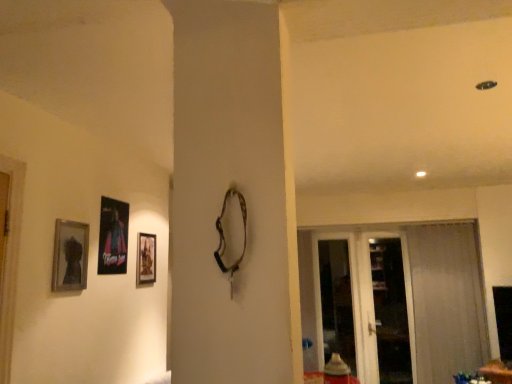
What do you see at coordinates (113, 237) in the screenshot?
I see `metallic poster at left, which appears as the 2th picture frame when viewed from the front` at bounding box center [113, 237].

You are a GUI agent. You are given a task and a screenshot of the screen. Output one action in this format:
    pyautogui.click(x=<x>, y=<y>)
    Task: Click on the metallic poster at left, which appears as the 2th picture frame when viewed from the front
    Image resolution: width=512 pixels, height=384 pixels.
    Given the screenshot: What is the action you would take?
    pyautogui.click(x=113, y=237)

Locate an element on the screen. matte black picture frame at left, acting as the first picture frame starting from the left is located at coordinates (70, 256).

The height and width of the screenshot is (384, 512). What do you see at coordinates (70, 256) in the screenshot?
I see `matte black picture frame at left, which is the 3th picture frame from back to front` at bounding box center [70, 256].

At what (x,y) coordinates should I click in order to perform the action: click on metallic poster at left, placed as the 2th picture frame when sorted from back to front. Please return your answer as a coordinate pair (x, y). Image resolution: width=512 pixels, height=384 pixels. Looking at the image, I should click on (113, 237).

Which object is thinner, transparent glass screen door at right, marked as the first screen door in a left-to-right arrangement, or metallic poster at left, placed as the 2th picture frame when sorted from back to front?

Thinner between the two is metallic poster at left, placed as the 2th picture frame when sorted from back to front.

The width and height of the screenshot is (512, 384). In order to click on the 2nd picture frame counting from the left of the transparent glass screen door at right, acting as the second screen door starting from the right in this screenshot , I will do `click(113, 237)`.

Is transparent glass screen door at right, acting as the second screen door starting from the right, looking in the opposite direction of metallic poster at left, placed as the 2th picture frame when sorted from back to front?

transparent glass screen door at right, acting as the second screen door starting from the right, is not turned away from metallic poster at left, placed as the 2th picture frame when sorted from back to front.

Is sheer white curtain at right bigger than transparent glass screen door at right, which ranks as the 1th screen door in right-to-left order?

Yes.

Can you confirm if sheer white curtain at right is wider than transparent glass screen door at right, which ranks as the 1th screen door in right-to-left order?

Yes.

Which point is more distant from viewer, (420, 348) or (343, 244)?

The point (343, 244) is farther from the camera.

Is transparent glass screen door at right, the 2th screen door viewed from the left, inside sheer white curtain at right?

No, sheer white curtain at right does not contain transparent glass screen door at right, the 2th screen door viewed from the left.

Would you say transparent glass screen door at right, marked as the first screen door in a left-to-right arrangement, is part of metallic poster at left, placed as the 2th picture frame when sorted from right to left,'s contents?

No, transparent glass screen door at right, marked as the first screen door in a left-to-right arrangement, is located outside of metallic poster at left, placed as the 2th picture frame when sorted from right to left.

Is metallic poster at left, which appears as the 2th picture frame when viewed from the front, next to transparent glass screen door at right, marked as the first screen door in a left-to-right arrangement, and touching it?

metallic poster at left, which appears as the 2th picture frame when viewed from the front, is not next to transparent glass screen door at right, marked as the first screen door in a left-to-right arrangement, and they're not touching.

From the image's perspective, between metallic poster at left, the second picture frame viewed from the left, and transparent glass screen door at right, marked as the first screen door in a left-to-right arrangement, who is located below?

From the image's view, transparent glass screen door at right, marked as the first screen door in a left-to-right arrangement, is below.

Is transparent glass screen door at right, acting as the second screen door starting from the right, at the back of matte wooden picture frame at center, which is the 3th picture frame from front to back?

matte wooden picture frame at center, which is the 3th picture frame from front to back, does not have its back to transparent glass screen door at right, acting as the second screen door starting from the right.

Looking at this image, which object is positioned more to the left, matte wooden picture frame at center, which is the 3th picture frame from front to back, or transparent glass screen door at right, marked as the first screen door in a left-to-right arrangement?

Positioned to the left is matte wooden picture frame at center, which is the 3th picture frame from front to back.

Could you measure the distance between matte wooden picture frame at center, placed as the third picture frame when sorted from left to right, and transparent glass screen door at right, marked as the first screen door in a left-to-right arrangement?

matte wooden picture frame at center, placed as the third picture frame when sorted from left to right, is 7.64 feet away from transparent glass screen door at right, marked as the first screen door in a left-to-right arrangement.

In the image, is matte wooden picture frame at center, which is the 3th picture frame from front to back, positioned in front of or behind transparent glass screen door at right, marked as the first screen door in a left-to-right arrangement?

In the image, matte wooden picture frame at center, which is the 3th picture frame from front to back, appears in front of transparent glass screen door at right, marked as the first screen door in a left-to-right arrangement.

Which is in front, point (442, 250) or point (121, 264)?

The point (121, 264) is closer.

How many degrees apart are the facing directions of sheer white curtain at right and metallic poster at left, which appears as the 2th picture frame when viewed from the front?

There is a 90-degree angle between the facing directions of sheer white curtain at right and metallic poster at left, which appears as the 2th picture frame when viewed from the front.

Considering the sizes of objects sheer white curtain at right and metallic poster at left, which appears as the 2th picture frame when viewed from the front, in the image provided, who is wider, sheer white curtain at right or metallic poster at left, which appears as the 2th picture frame when viewed from the front,?

Wider between the two is sheer white curtain at right.

Is matte black picture frame at left, which ranks as the 3th picture frame in right-to-left order, located outside metallic poster at left, the second picture frame viewed from the left?

That's correct, matte black picture frame at left, which ranks as the 3th picture frame in right-to-left order, is outside of metallic poster at left, the second picture frame viewed from the left.

Which object is further away from the camera taking this photo, matte black picture frame at left, acting as the first picture frame starting from the left, or metallic poster at left, which appears as the 2th picture frame when viewed from the front?

Positioned behind is metallic poster at left, which appears as the 2th picture frame when viewed from the front.

Considering the sizes of objects matte black picture frame at left, which is the 3th picture frame from back to front, and metallic poster at left, the second picture frame viewed from the left, in the image provided, who is shorter, matte black picture frame at left, which is the 3th picture frame from back to front, or metallic poster at left, the second picture frame viewed from the left,?

matte black picture frame at left, which is the 3th picture frame from back to front.

Relative to transparent glass screen door at right, acting as the second screen door starting from the right, is matte black picture frame at left, which ranks as the 3th picture frame in right-to-left order, in front or behind?

matte black picture frame at left, which ranks as the 3th picture frame in right-to-left order, is positioned closer to the viewer than transparent glass screen door at right, acting as the second screen door starting from the right.

Which is in front, point (86, 231) or point (331, 306)?

Point (86, 231)

From the image's perspective, is matte black picture frame at left, acting as the first picture frame starting from the left, positioned above or below transparent glass screen door at right, acting as the second screen door starting from the right?

From the image's perspective, matte black picture frame at left, acting as the first picture frame starting from the left, appears above transparent glass screen door at right, acting as the second screen door starting from the right.

Locate an element on the screen. The image size is (512, 384). screen door that is the 1st one when counting downward from the matte black picture frame at left, which ranks as the 3th picture frame in right-to-left order (from the image's perspective) is located at coordinates (335, 298).

Locate an element on the screen. This screenshot has height=384, width=512. the 2nd picture frame in front when counting from the transparent glass screen door at right, marked as the first screen door in a left-to-right arrangement is located at coordinates (113, 237).

The width and height of the screenshot is (512, 384). Find the location of `curtain that appears on the right of transparent glass screen door at right, which ranks as the 1th screen door in right-to-left order`. curtain that appears on the right of transparent glass screen door at right, which ranks as the 1th screen door in right-to-left order is located at coordinates (447, 301).

Based on their spatial positions, is matte wooden picture frame at center, which is the 3th picture frame from front to back, or metallic poster at left, placed as the 2th picture frame when sorted from back to front, closer to transparent glass screen door at right, the 2th screen door viewed from the left?

Based on the image, matte wooden picture frame at center, which is the 3th picture frame from front to back, appears to be nearer to transparent glass screen door at right, the 2th screen door viewed from the left.

Which object lies nearer to the anchor point matte wooden picture frame at center, which is the 3th picture frame from front to back, sheer white curtain at right or transparent glass screen door at right, marked as the first screen door in a left-to-right arrangement?

Among the two, transparent glass screen door at right, marked as the first screen door in a left-to-right arrangement, is located nearer to matte wooden picture frame at center, which is the 3th picture frame from front to back.

Looking at the image, which one is located closer to matte black picture frame at left, which is the 3th picture frame from back to front, sheer white curtain at right or transparent glass screen door at right, which ranks as the 1th screen door in right-to-left order?

transparent glass screen door at right, which ranks as the 1th screen door in right-to-left order.

Considering their positions, is transparent glass screen door at right, the 2th screen door viewed from the left, positioned closer to transparent glass screen door at right, acting as the second screen door starting from the right, than matte black picture frame at left, which is the 3th picture frame from back to front?

Among the two, transparent glass screen door at right, the 2th screen door viewed from the left, is located nearer to transparent glass screen door at right, acting as the second screen door starting from the right.

From the image, which object appears to be farther from matte wooden picture frame at center, the 1th picture frame from the right, matte black picture frame at left, acting as the first picture frame starting from the left, or transparent glass screen door at right, the 2th screen door viewed from the left?

transparent glass screen door at right, the 2th screen door viewed from the left, lies further to matte wooden picture frame at center, the 1th picture frame from the right, than the other object.

Looking at the image, which one is located closer to matte black picture frame at left, the first picture frame in the front-to-back sequence, transparent glass screen door at right, marked as the first screen door in a left-to-right arrangement, or metallic poster at left, placed as the 2th picture frame when sorted from back to front?

Among the two, metallic poster at left, placed as the 2th picture frame when sorted from back to front, is located nearer to matte black picture frame at left, the first picture frame in the front-to-back sequence.

Which object lies further to the anchor point metallic poster at left, the second picture frame viewed from the left, transparent glass screen door at right, acting as the second screen door starting from the right, or sheer white curtain at right?

sheer white curtain at right is further to metallic poster at left, the second picture frame viewed from the left.

Considering their positions, is matte black picture frame at left, which ranks as the 3th picture frame in right-to-left order, positioned further to metallic poster at left, placed as the 2th picture frame when sorted from right to left, than transparent glass screen door at right, which ranks as the 1th screen door in right-to-left order?

transparent glass screen door at right, which ranks as the 1th screen door in right-to-left order, lies further to metallic poster at left, placed as the 2th picture frame when sorted from right to left, than the other object.

You are a GUI agent. You are given a task and a screenshot of the screen. Output one action in this format:
    pyautogui.click(x=<x>, y=<y>)
    Task: Click on the screen door situated between matte wooden picture frame at center, placed as the third picture frame when sorted from left to right, and transparent glass screen door at right, which ranks as the 1th screen door in right-to-left order, from left to right
    
    Given the screenshot: What is the action you would take?
    pyautogui.click(x=335, y=298)

Find the location of `picture frame between metallic poster at left, placed as the 2th picture frame when sorted from back to front, and transparent glass screen door at right, the 2th screen door viewed from the left, in the horizontal direction`. picture frame between metallic poster at left, placed as the 2th picture frame when sorted from back to front, and transparent glass screen door at right, the 2th screen door viewed from the left, in the horizontal direction is located at coordinates (x=146, y=259).

Image resolution: width=512 pixels, height=384 pixels. In order to click on screen door between transparent glass screen door at right, acting as the second screen door starting from the right, and sheer white curtain at right from left to right in this screenshot , I will do `click(364, 304)`.

Locate an element on the screen. This screenshot has height=384, width=512. screen door positioned between matte black picture frame at left, which ranks as the 3th picture frame in right-to-left order, and transparent glass screen door at right, acting as the second screen door starting from the right, from near to far is located at coordinates (364, 304).